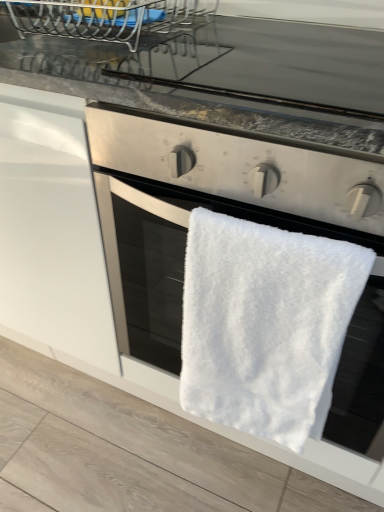
Question: From a real-world perspective, is white fluffy towel at center physically located above or below black glass at upper center?

Choices:
 (A) above
 (B) below

Answer: (B)

Question: Relative to black glass at upper center, is white fluffy towel at center in front or behind?

Choices:
 (A) front
 (B) behind

Answer: (A)

Question: From the image's perspective, is white fluffy towel at center located above or below black glass at upper center?

Choices:
 (A) above
 (B) below

Answer: (B)

Question: From the image's perspective, is black glass at upper center positioned above or below white fluffy towel at center?

Choices:
 (A) below
 (B) above

Answer: (B)

Question: In terms of size, does black glass at upper center appear bigger or smaller than white fluffy towel at center?

Choices:
 (A) small
 (B) big

Answer: (A)

Question: Does point (94, 57) appear closer or farther from the camera than point (269, 374)?

Choices:
 (A) farther
 (B) closer

Answer: (B)

Question: From a real-world perspective, relative to white fluffy towel at center, is black glass at upper center vertically above or below?

Choices:
 (A) below
 (B) above

Answer: (B)